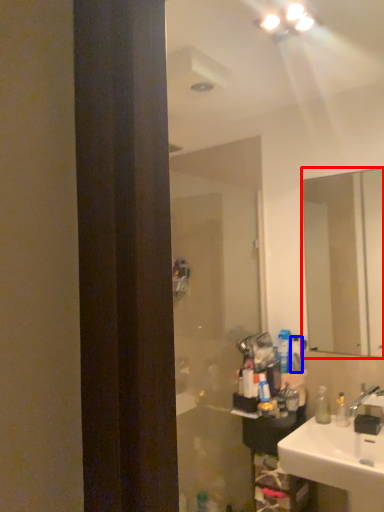
Question: Among these objects, which one is nearest to the camera, mirror (highlighted by a red box) or toiletry (highlighted by a blue box)?

Choices:
 (A) mirror
 (B) toiletry

Answer: (A)